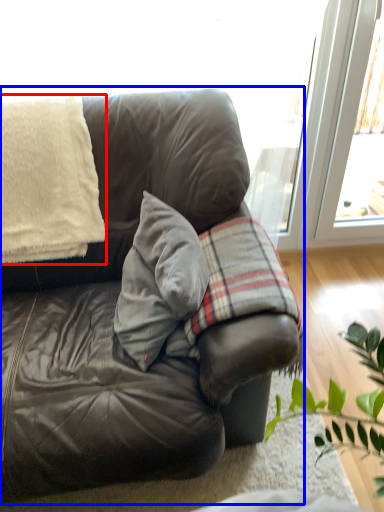
Question: Which object is closer to the camera taking this photo, blanket (highlighted by a red box) or studio couch (highlighted by a blue box)?

Choices:
 (A) blanket
 (B) studio couch

Answer: (B)